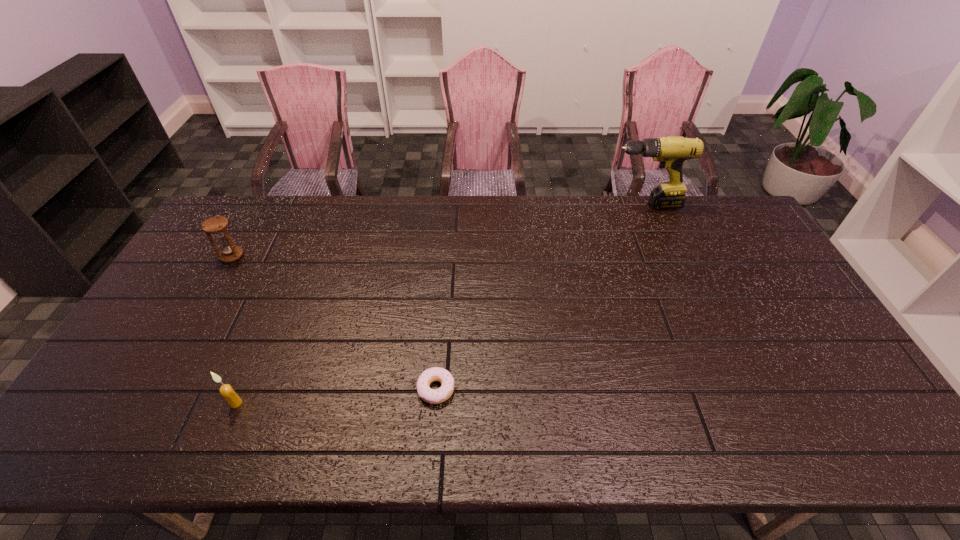
Where is `blank space located on the back of the leftmost object`? blank space located on the back of the leftmost object is located at coordinates (256, 213).

Identify the location of free space located 0.050m on the right of the third object from right to left. (262, 403).

Where is `vacant area situated on the right of the shortest object`? vacant area situated on the right of the shortest object is located at coordinates (539, 389).

Find the location of `object at the far edge`. object at the far edge is located at coordinates (671, 151).

You are a GUI agent. You are given a task and a screenshot of the screen. Output one action in this format:
    pyautogui.click(x=<x>, y=<y>)
    Task: Click on the object located in the left edge section of the desktop
    Image resolution: width=960 pixels, height=540 pixels.
    Given the screenshot: What is the action you would take?
    pyautogui.click(x=217, y=226)

I want to click on free space at the far edge, so click(635, 208).

I want to click on vacant space at the near edge of the desktop, so click(558, 422).

In the image, there is a desktop. Identify the location of vacant space at the left edge. This screenshot has width=960, height=540. tap(180, 309).

Image resolution: width=960 pixels, height=540 pixels. In the image, there is a desktop. Identify the location of vacant area at the right edge. (808, 374).

Identify the location of free point between the doughnut and the second object from left to right. (336, 396).